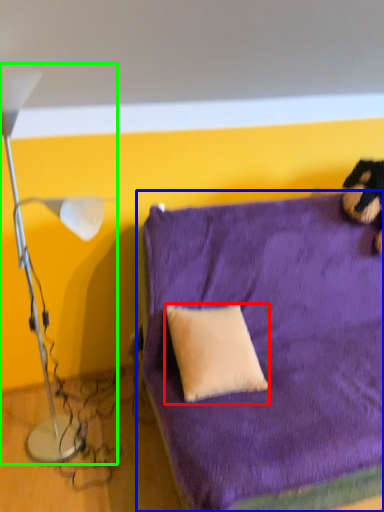
Question: Which object is the closest to the pillow (highlighted by a red box)? Choose among these: furniture (highlighted by a blue box) or lamp (highlighted by a green box).

Choices:
 (A) furniture
 (B) lamp

Answer: (A)